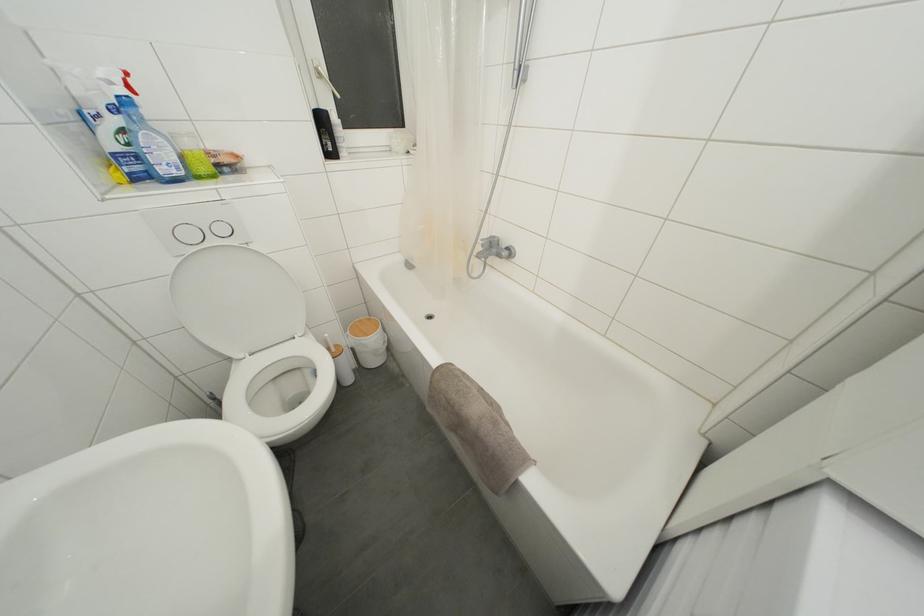
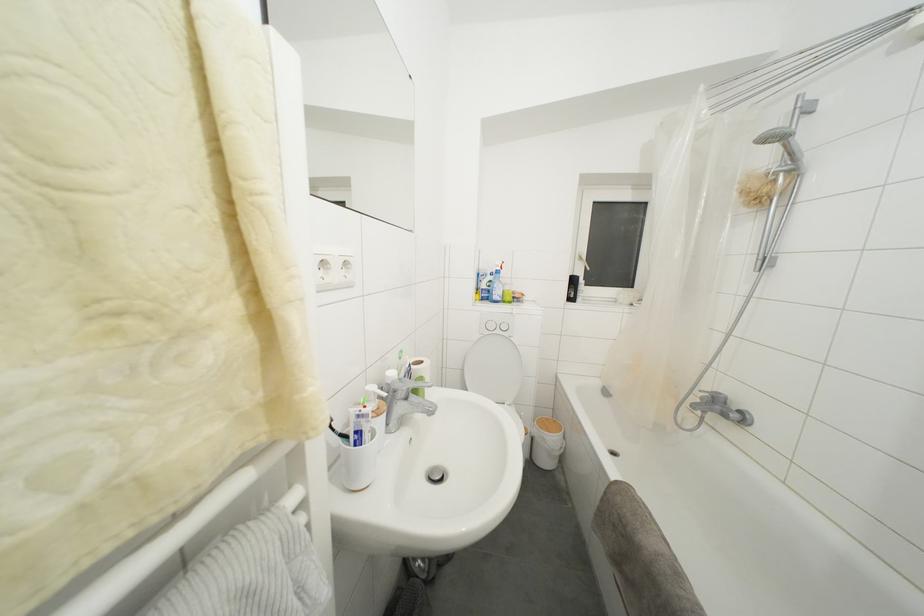
The first image is from the beginning of the video and the second image is from the end. How did the camera likely rotate when shooting the video?

The rotation direction of the camera is left-up.